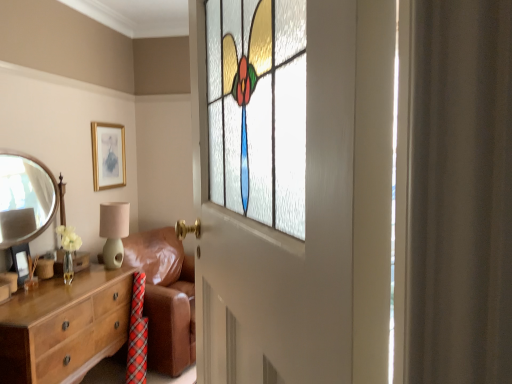
Identify the location of empty space that is ontop of wooden chest of drawers at left (from a real-world perspective). (42, 292).